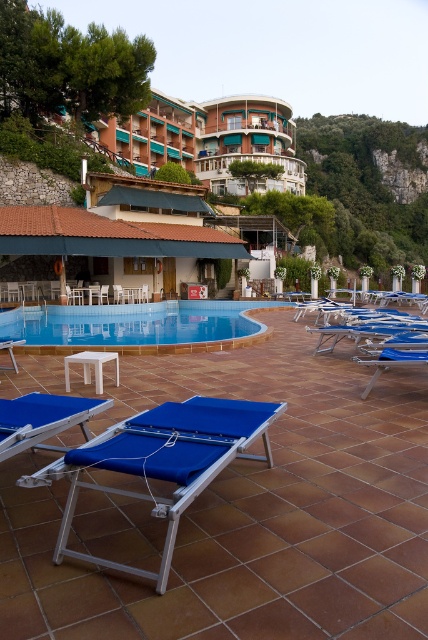
Question: Is blue glossy pool at center smaller than blue fabric beach chair at lower left?

Choices:
 (A) yes
 (B) no

Answer: (B)

Question: Considering the real-world distances, which object is closest to the blue fabric beach chair at right?

Choices:
 (A) blue glossy pool at center
 (B) blue fabric beach chair at lower right
 (C) blue fabric beach chair at lower left

Answer: (B)

Question: Does blue glossy pool at center have a larger size compared to blue fabric beach chair at lower left?

Choices:
 (A) yes
 (B) no

Answer: (A)

Question: Estimate the real-world distances between objects in this image. Which object is closer to the blue fabric beach chair at lower left?

Choices:
 (A) green leafy hillside at upper right
 (B) blue fabric beach chair at lower right

Answer: (B)

Question: Is blue fabric beach chair at right further to the viewer compared to blue fabric beach chair at lower left?

Choices:
 (A) no
 (B) yes

Answer: (B)

Question: Which is nearer to the blue fabric beach chair at right?

Choices:
 (A) blue fabric beach chair at lower left
 (B) blue glossy pool at center

Answer: (B)